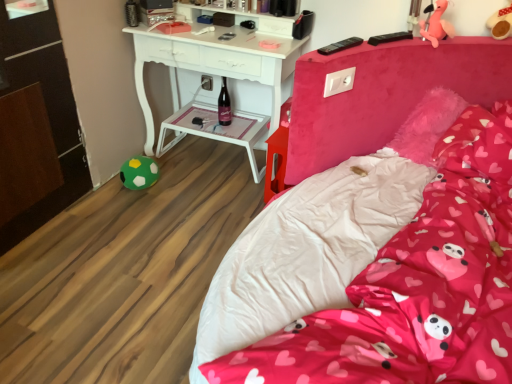
Question: In terms of size, does green felt ball at lower left, the 1th toy when ordered from left to right, appear bigger or smaller than matte glass bottle at center?

Choices:
 (A) small
 (B) big

Answer: (B)

Question: Considering their positions, is green felt ball at lower left, the 1th toy when ordered from bottom to top, located in front of or behind matte glass bottle at center?

Choices:
 (A) front
 (B) behind

Answer: (A)

Question: Estimate the real-world distances between objects in this image. Which object is farther from the green felt ball at lower left, the 1th toy in the back-to-front sequence?

Choices:
 (A) pink plush toy at upper right, the 3th toy from the left
 (B) pink plush toy at upper right, arranged as the second toy when viewed from the right
 (C) matte glass bottle at center
 (D) pink fabric bed at center
 (E) white plastic side table at center

Answer: (A)

Question: Which object is positioned closest to the pink fabric pillow at center?

Choices:
 (A) green felt ball at lower left, marked as the 3th toy in a right-to-left arrangement
 (B) pink plush toy at upper right, the 1th toy from the top
 (C) pink plush toy at upper right, the third toy from the back
 (D) pink fabric bed at center
 (E) matte glass bottle at center

Answer: (D)